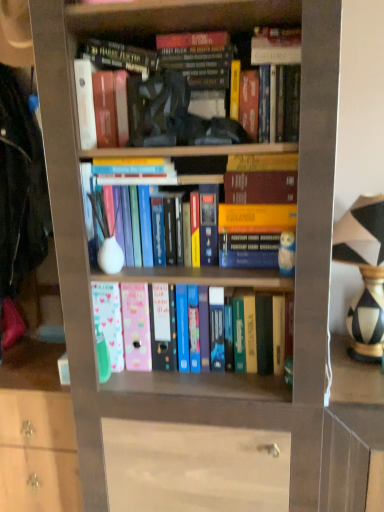
Question: Is hardcover book at upper center, which appears as the 2th book when ordered from the bottom, shorter than black-and-white striped vase at right?

Choices:
 (A) yes
 (B) no

Answer: (A)

Question: Can you confirm if hardcover book at upper center, which is the 2th book from top to bottom, is thinner than black-and-white striped vase at right?

Choices:
 (A) yes
 (B) no

Answer: (A)

Question: From a real-world perspective, is hardcover book at upper center, which appears as the 2th book when ordered from the bottom, on black-and-white striped vase at right?

Choices:
 (A) yes
 (B) no

Answer: (A)

Question: From the image's perspective, is hardcover book at upper center, which appears as the 2th book when ordered from the bottom, above black-and-white striped vase at right?

Choices:
 (A) no
 (B) yes

Answer: (B)

Question: Is hardcover book at upper center, which is the 2th book from top to bottom, turned away from black-and-white striped vase at right?

Choices:
 (A) yes
 (B) no

Answer: (B)

Question: From a real-world perspective, relative to black-and-white striped vase at right, is hardcover book at upper center, which is the 2th book from top to bottom, vertically above or below?

Choices:
 (A) below
 (B) above

Answer: (B)

Question: In the image, is hardcover book at upper center, which appears as the 2th book when ordered from the bottom, on the left side or the right side of black-and-white striped vase at right?

Choices:
 (A) right
 (B) left

Answer: (B)

Question: Is hardcover book at upper center, which is the 2th book from top to bottom, bigger or smaller than black-and-white striped vase at right?

Choices:
 (A) big
 (B) small

Answer: (B)

Question: In terms of height, does hardcover book at upper center, which appears as the 2th book when ordered from the bottom, look taller or shorter compared to black-and-white striped vase at right?

Choices:
 (A) tall
 (B) short

Answer: (B)

Question: Would you say black-and-white striped vase at right is inside or outside hardcover book at upper center, which appears as the 2th book when ordered from the bottom?

Choices:
 (A) outside
 (B) inside

Answer: (A)

Question: Considering their positions, is black-and-white striped vase at right located in front of or behind hardcover book at upper center, which appears as the 2th book when ordered from the bottom?

Choices:
 (A) behind
 (B) front

Answer: (B)

Question: Considering the positions of point (367, 283) and point (114, 59), is point (367, 283) closer or farther from the camera than point (114, 59)?

Choices:
 (A) farther
 (B) closer

Answer: (A)

Question: Considering the positions of black-and-white striped vase at right and hardcover book at upper center, which appears as the 2th book when ordered from the bottom, in the image, is black-and-white striped vase at right taller or shorter than hardcover book at upper center, which appears as the 2th book when ordered from the bottom,?

Choices:
 (A) short
 (B) tall

Answer: (B)

Question: In terms of height, does black-and-white striped vase at right look taller or shorter compared to hardcover book at upper center, which ranks as the third book in bottom-to-top order?

Choices:
 (A) short
 (B) tall

Answer: (B)

Question: Is black-and-white striped vase at right wider or thinner than hardcover book at upper center, which ranks as the third book in bottom-to-top order?

Choices:
 (A) thin
 (B) wide

Answer: (B)